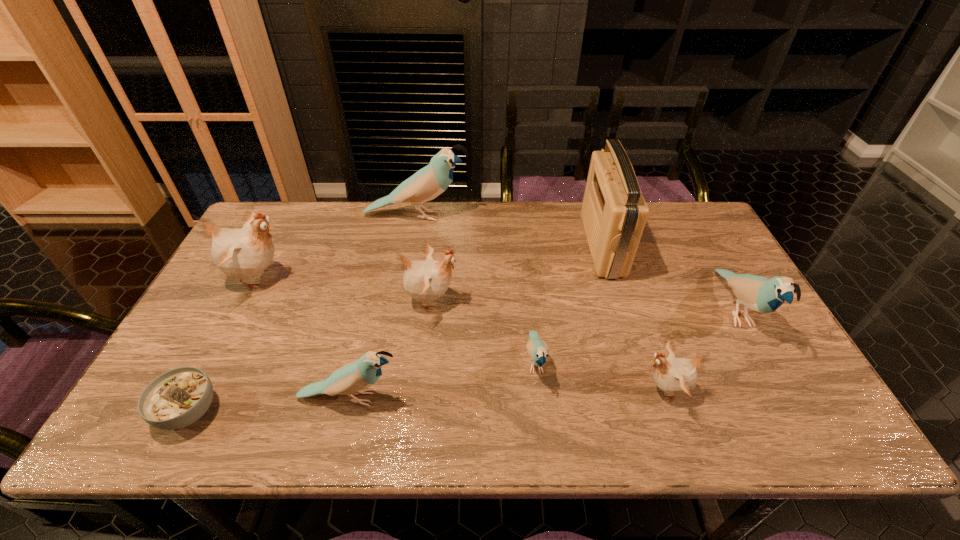
I want to click on vacant space located at the face of the rightmost bird, so click(796, 418).

The width and height of the screenshot is (960, 540). I want to click on free point located 0.060m at the beak of the second biggest white bird, so [481, 301].

Identify the location of vacant space located at the face of the third biggest blue bird. This screenshot has height=540, width=960. (511, 398).

The width and height of the screenshot is (960, 540). I want to click on free space located 0.300m at the beak of the nearest white bird, so click(x=510, y=390).

Locate an element on the screen. The image size is (960, 540). vacant space located at the beak of the nearest white bird is located at coordinates (532, 390).

The image size is (960, 540). I want to click on free space located 0.090m at the beak of the nearest white bird, so click(x=600, y=390).

You are a GUI agent. You are given a task and a screenshot of the screen. Output one action in this format:
    pyautogui.click(x=<x>, y=<y>)
    Task: Click on the vacant space situated at the face of the sixth object from left to right
    
    Given the screenshot: What is the action you would take?
    pyautogui.click(x=541, y=413)

At what (x,y) coordinates should I click in order to perform the action: click on radio receiver present at the far edge. Please return your answer as a coordinate pair (x, y). This screenshot has height=540, width=960. Looking at the image, I should click on (614, 212).

This screenshot has width=960, height=540. I want to click on bird that is at the far edge, so click(429, 182).

Find the location of a particular element. soup bowl that is positioned at the near edge is located at coordinates (179, 397).